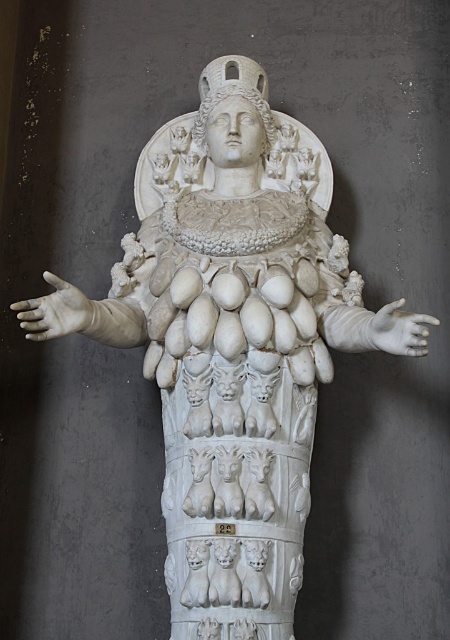
You are standing in front of the classical marble statue and want to touch both points on the statue. Which point, point [64,291] or point [432,323], will you reach first?

Point [64,291] is further to the camera than point [432,323], so you will reach point [64,291] first because it is closer to you.

From the picture: You are an art conservator examining the statue. You notice two white hands on the statue. The first is the white matte hand at left, and the second is the white marble hand at center. Which hand is taller?

The white matte hand at left is taller than the white marble hand at center.

In the scene described, where is the white matte hand at left positioned in terms of coordinates?

The white matte hand at left is positioned at coordinates 0.487 in the x axis and 0.120 in the y axis.